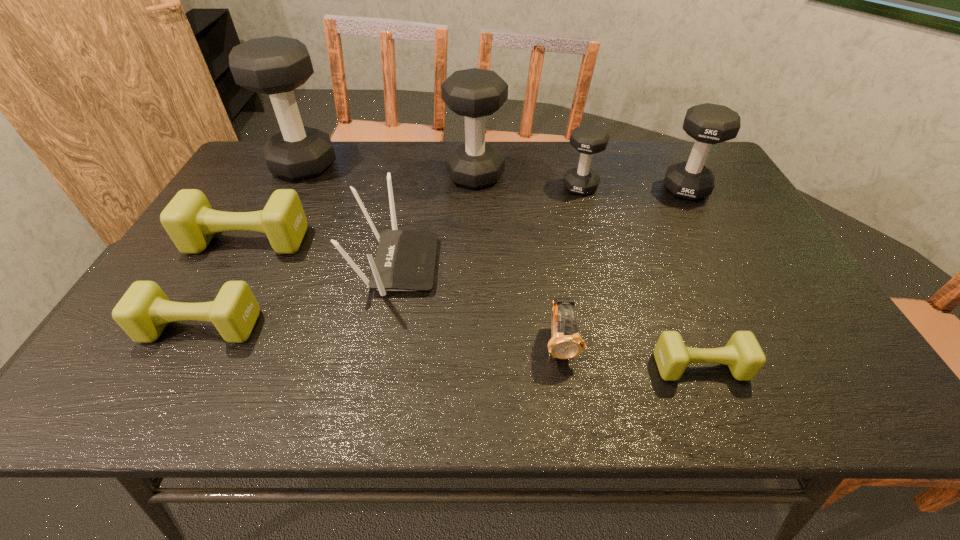
Select which olive dumbbell is the second closest to the smallest gray dumbbell. Please provide its 2D coordinates. Your answer should be formatted as a tuple, i.e. [(x, y)], where the tuple contains the x and y coordinates of a point satisfying the conditions above.

[(189, 220)]

I want to click on vacant space that satisfies the following two spatial constraints: 1. on the face of the watch; 2. on the left side of the shortest dumbbell, so click(564, 367).

This screenshot has height=540, width=960. In order to click on vacant point that satisfies the following two spatial constraints: 1. on the front side of the second tallest object; 2. on the right side of the nearest dumbbell in this screenshot , I will do pyautogui.click(x=473, y=367).

The image size is (960, 540). I want to click on free spot that satisfies the following two spatial constraints: 1. on the back side of the fifth farthest dumbbell; 2. on the right side of the third tallest dumbbell, so click(276, 188).

Where is `vacant space that satisfies the following two spatial constraints: 1. on the back side of the smallest gray dumbbell; 2. on the left side of the second smallest olive dumbbell`? vacant space that satisfies the following two spatial constraints: 1. on the back side of the smallest gray dumbbell; 2. on the left side of the second smallest olive dumbbell is located at coordinates (278, 187).